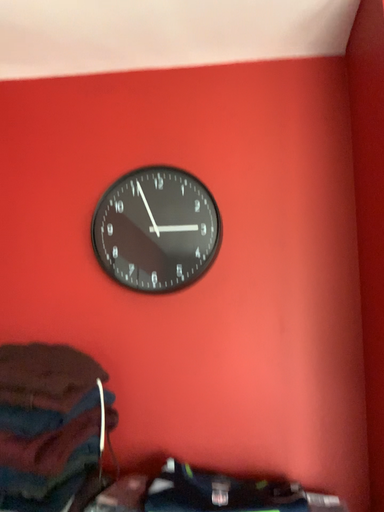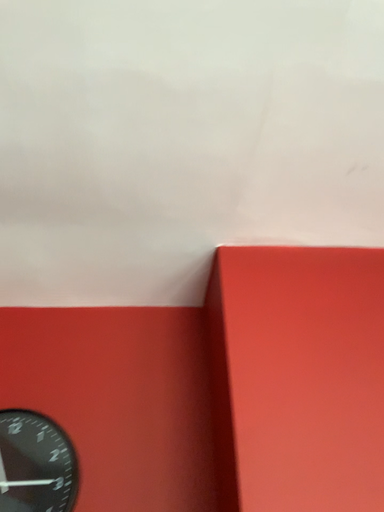
Question: How did the camera likely rotate when shooting the video?

Choices:
 (A) rotated downward
 (B) rotated upward

Answer: (B)